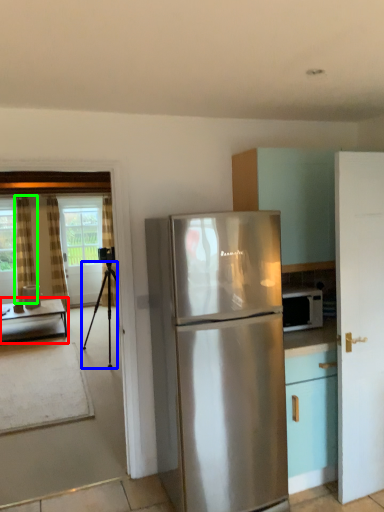
Question: Which is nearer to the table (highlighted by a red box)? tripod (highlighted by a blue box) or curtain (highlighted by a green box).

Choices:
 (A) tripod
 (B) curtain

Answer: (B)